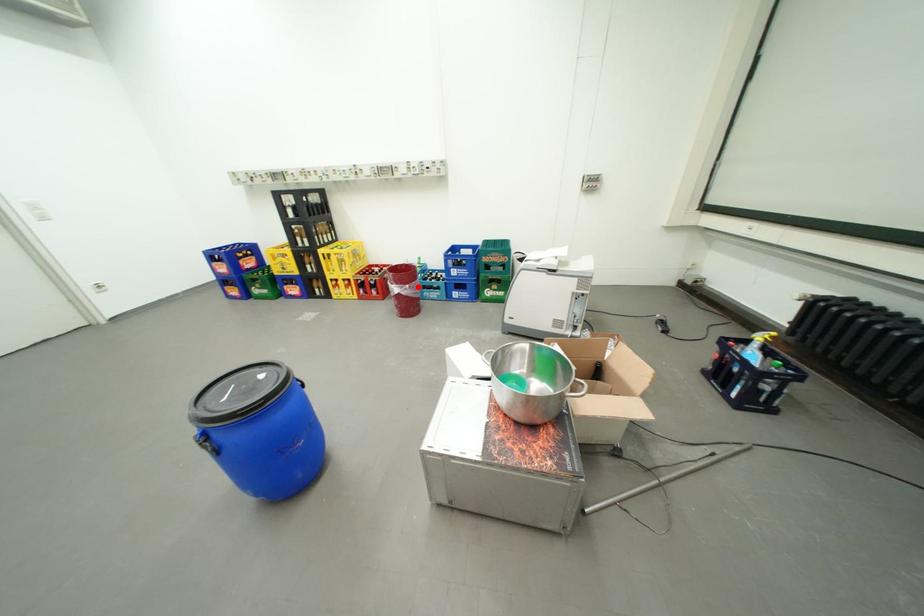
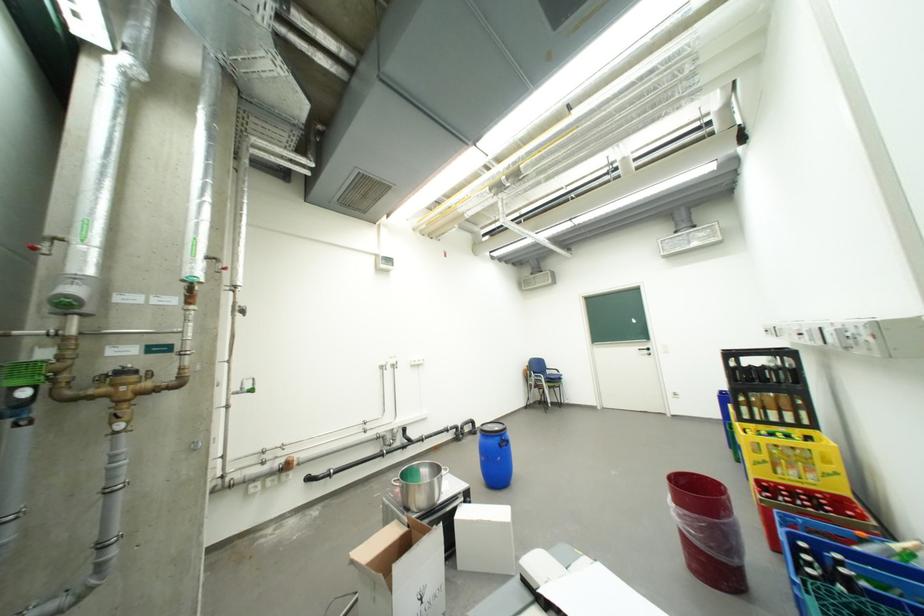
Question: I am providing you with two images of the same scene from different viewpoints. In image1, a red point is highlighted. Considering the same 3D point in image2, which of the following is correct?

Choices:
 (A) It is closer
 (B) It is farther

Answer: (B)